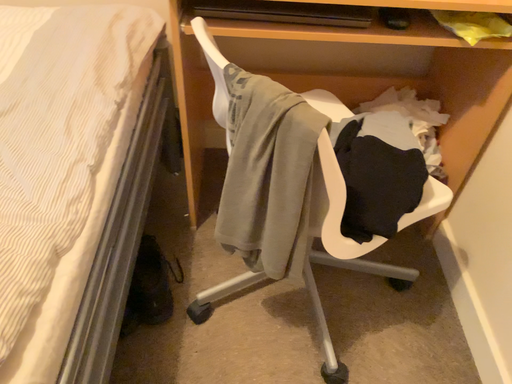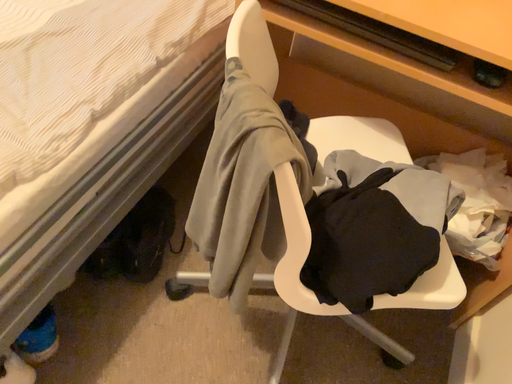
Question: Which way did the camera rotate in the video?

Choices:
 (A) rotated left
 (B) rotated right

Answer: (A)